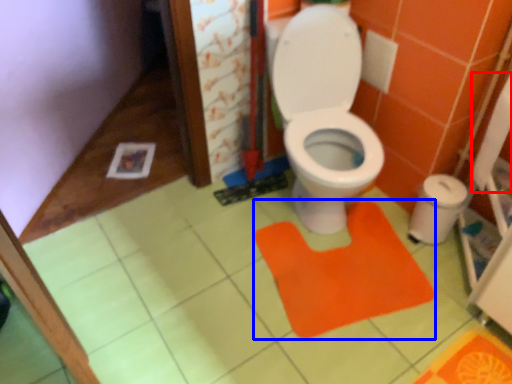
Question: Which object appears closest to the camera in this image, toilet paper (highlighted by a red box) or doormat (highlighted by a blue box)?

Choices:
 (A) toilet paper
 (B) doormat

Answer: (A)